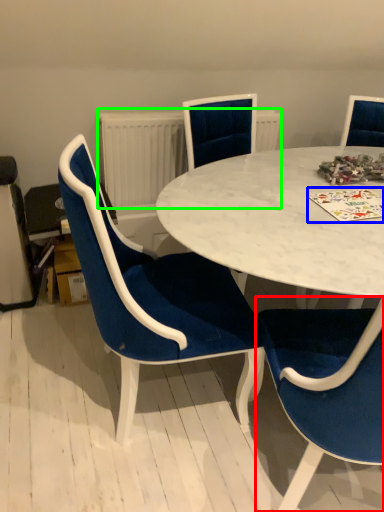
Question: Which is nearer to the chair (highlighted by a red box)? card game (highlighted by a blue box) or radiator (highlighted by a green box).

Choices:
 (A) card game
 (B) radiator

Answer: (A)